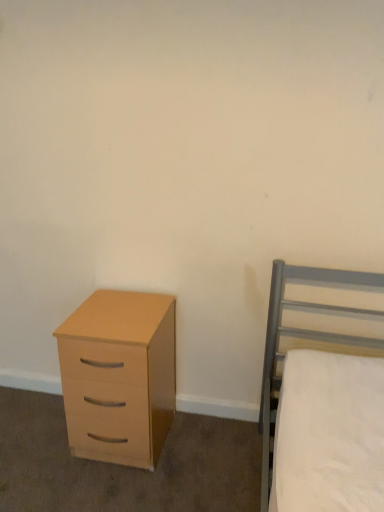
I want to click on vacant space situated on the left part of light wood/veneer chest of drawers at lower left, so click(35, 440).